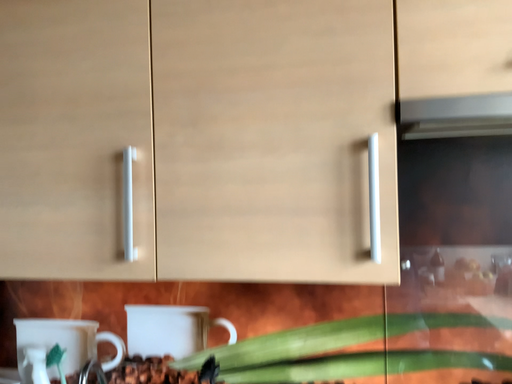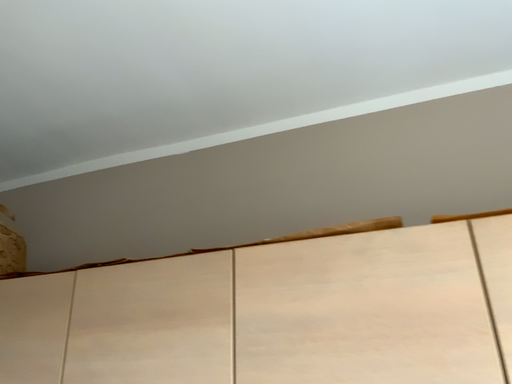
Question: How did the camera likely rotate when shooting the video?

Choices:
 (A) rotated left
 (B) rotated right

Answer: (A)